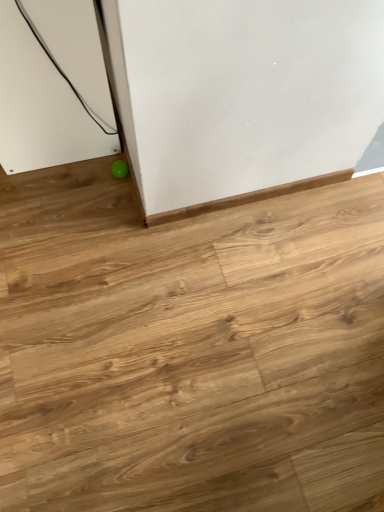
Question: Relative to light brown wood floor at lower left, is green rubber ball at lower left in front or behind?

Choices:
 (A) behind
 (B) front

Answer: (A)

Question: Would you say green rubber ball at lower left is inside or outside light brown wood floor at lower left?

Choices:
 (A) outside
 (B) inside

Answer: (B)

Question: Is green rubber ball at lower left bigger or smaller than light brown wood floor at lower left?

Choices:
 (A) small
 (B) big

Answer: (A)

Question: Would you say light brown wood floor at lower left is inside or outside green rubber ball at lower left?

Choices:
 (A) outside
 (B) inside

Answer: (A)

Question: From the image's perspective, is light brown wood floor at lower left located above or below green rubber ball at lower left?

Choices:
 (A) below
 (B) above

Answer: (A)

Question: Visually, is light brown wood floor at lower left positioned to the left or to the right of green rubber ball at lower left?

Choices:
 (A) right
 (B) left

Answer: (A)

Question: From a real-world perspective, is light brown wood floor at lower left physically located above or below green rubber ball at lower left?

Choices:
 (A) above
 (B) below

Answer: (B)